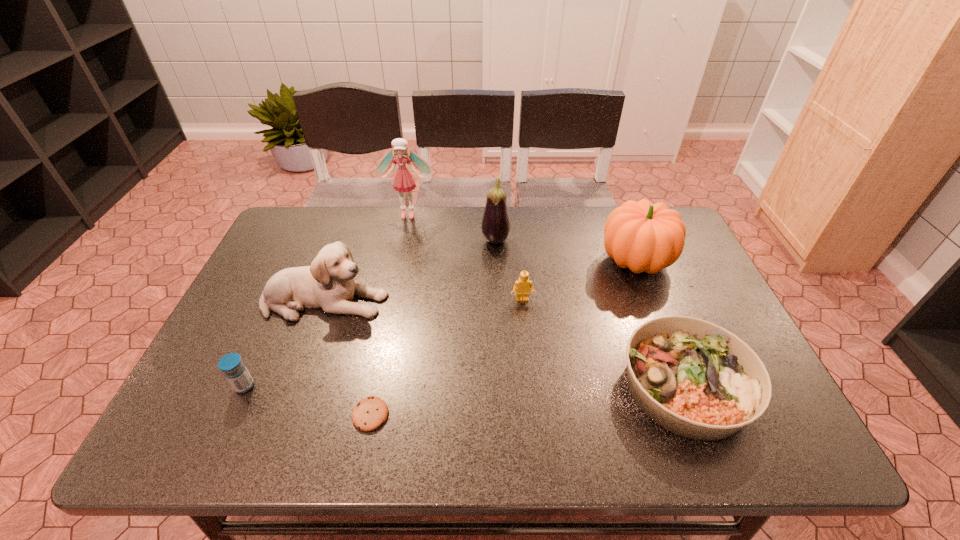
This screenshot has width=960, height=540. Find the location of `salad plate located in the near edge section of the desktop`. salad plate located in the near edge section of the desktop is located at coordinates (696, 379).

You are a GUI agent. You are given a task and a screenshot of the screen. Output one action in this format:
    pyautogui.click(x=<x>, y=<y>)
    Task: Click on the cookie located at the near edge
    The height and width of the screenshot is (540, 960).
    Given the screenshot: What is the action you would take?
    point(368,414)

This screenshot has width=960, height=540. Identify the location of puppy at the left edge. (328, 284).

Find the location of a particular element. The height and width of the screenshot is (540, 960). medicine that is positioned at the left edge is located at coordinates (235, 371).

Where is `pumpkin positioned at the right edge`? The width and height of the screenshot is (960, 540). pumpkin positioned at the right edge is located at coordinates (644, 237).

Where is `salad plate that is at the right edge`? The width and height of the screenshot is (960, 540). salad plate that is at the right edge is located at coordinates (696, 379).

Locate an element on the screen. This screenshot has width=960, height=540. object that is at the far right corner is located at coordinates (644, 237).

Find the location of a particular element. object situated at the near right corner is located at coordinates (696, 379).

Where is `vacant area at the far edge of the desktop`? This screenshot has width=960, height=540. vacant area at the far edge of the desktop is located at coordinates (484, 247).

In the image, there is a desktop. At what (x,y) coordinates should I click in order to perform the action: click on free region at the near edge. Please return your answer as a coordinate pair (x, y). Looking at the image, I should click on (583, 441).